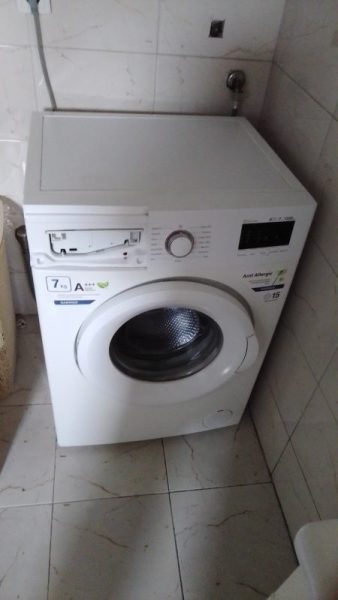
Locate an element on the screen. liquids dispenser is located at coordinates (76, 243).